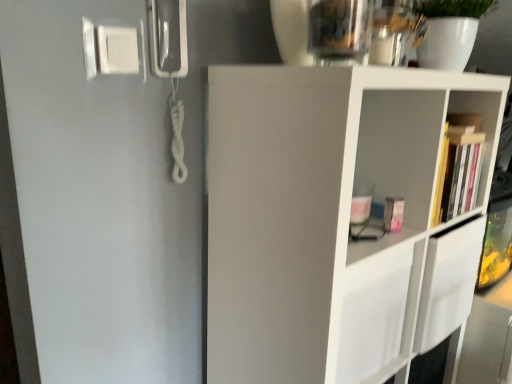
Image resolution: width=512 pixels, height=384 pixels. What do you see at coordinates (459, 174) in the screenshot?
I see `hardcover book at right` at bounding box center [459, 174].

You are a GUI agent. You are given a task and a screenshot of the screen. Output one action in this format:
    pyautogui.click(x=<x>, y=<y>)
    Task: Click on the white matte shelf at center
    This screenshot has width=512, height=384.
    Given the screenshot: What is the action you would take?
    pyautogui.click(x=335, y=220)

The width and height of the screenshot is (512, 384). I want to click on hardcover book at right, so click(x=459, y=174).

Can you confirm if hardcover book at right is thinner than white matte shelf at center?

Correct, the width of hardcover book at right is less than that of white matte shelf at center.

Relative to white matte shelf at center, is hardcover book at right in front or behind?

hardcover book at right is positioned farther from the viewer than white matte shelf at center.

Where is `book behind the white matte shelf at center`? This screenshot has width=512, height=384. book behind the white matte shelf at center is located at coordinates tap(459, 174).

The width and height of the screenshot is (512, 384). What are the coordinates of `shelf that is under the transparent glass vase at upper center (from a real-world perspective)` in the screenshot? It's located at (335, 220).

Which is more to the right, transparent glass vase at upper center or white matte shelf at center?

From the viewer's perspective, white matte shelf at center appears more on the right side.

From a real-world perspective, which is physically below, transparent glass vase at upper center or white matte shelf at center?

white matte shelf at center, from a real-world perspective.

Is transparent glass vase at upper center turned away from white matte shelf at center?

No, transparent glass vase at upper center is not facing the opposite direction of white matte shelf at center.

Can you tell me how much white matte shelf at center and transparent glass vase at upper center differ in facing direction?

The angle between the facing direction of white matte shelf at center and the facing direction of transparent glass vase at upper center is 0.794 degrees.

Looking at this image, how distant is white matte shelf at center from transparent glass vase at upper center?

They are 16.18 inches apart.

Looking at their sizes, would you say white matte shelf at center is wider or thinner than transparent glass vase at upper center?

white matte shelf at center is wider than transparent glass vase at upper center.

In terms of height, does white matte shelf at center look taller or shorter compared to transparent glass vase at upper center?

white matte shelf at center is taller than transparent glass vase at upper center.

Is hardcover book at right taller or shorter than transparent glass vase at upper center?

In the image, hardcover book at right appears to be taller than transparent glass vase at upper center.

Can you confirm if hardcover book at right is positioned to the left of transparent glass vase at upper center?

In fact, hardcover book at right is to the right of transparent glass vase at upper center.

Considering the relative positions of hardcover book at right and transparent glass vase at upper center in the image provided, is hardcover book at right behind transparent glass vase at upper center?

Yes, hardcover book at right is further from the camera.

Based on their sizes in the image, would you say hardcover book at right is bigger or smaller than transparent glass vase at upper center?

In the image, hardcover book at right appears to be larger than transparent glass vase at upper center.

Where is `glass vase above the hardcover book at right (from a real-world perspective)`? glass vase above the hardcover book at right (from a real-world perspective) is located at coordinates point(339,30).

Is transparent glass vase at upper center in front of or behind hardcover book at right in the image?

In the image, transparent glass vase at upper center appears in front of hardcover book at right.

Would you say transparent glass vase at upper center is outside hardcover book at right?

Yes, transparent glass vase at upper center is located beyond the bounds of hardcover book at right.

Are transparent glass vase at upper center and hardcover book at right located far from each other?

transparent glass vase at upper center is actually quite close to hardcover book at right.

From a real-world perspective, is white matte shelf at center located beneath hardcover book at right?

Indeed, from a real-world perspective, white matte shelf at center is positioned beneath hardcover book at right.

Considering the positions of objects white matte shelf at center and hardcover book at right in the image provided, who is more to the left, white matte shelf at center or hardcover book at right?

From the viewer's perspective, white matte shelf at center appears more on the left side.

Is point (244, 92) positioned in front of point (479, 166)?

Yes, point (244, 92) is closer to viewer.

Does white matte shelf at center turn towards hardcover book at right?

Yes, white matte shelf at center faces towards hardcover book at right.

Where is `book on the right of white matte shelf at center`? book on the right of white matte shelf at center is located at coordinates (459, 174).

In order to click on shelf in front of the transparent glass vase at upper center in this screenshot , I will do `click(335, 220)`.

From the image, which object appears to be farther from hardcover book at right, white matte shelf at center or transparent glass vase at upper center?

transparent glass vase at upper center is positioned further to the anchor hardcover book at right.

Considering their positions, is hardcover book at right positioned closer to transparent glass vase at upper center than white matte shelf at center?

white matte shelf at center is positioned closer to the anchor transparent glass vase at upper center.

From the image, which object appears to be nearer to transparent glass vase at upper center, white matte shelf at center or hardcover book at right?

white matte shelf at center.

When comparing their distances from white matte shelf at center, does hardcover book at right or transparent glass vase at upper center seem closer?

hardcover book at right lies closer to white matte shelf at center than the other object.

Looking at the image, which one is located further to hardcover book at right, transparent glass vase at upper center or white matte shelf at center?

transparent glass vase at upper center is positioned further to the anchor hardcover book at right.

Which object lies further to the anchor point white matte shelf at center, transparent glass vase at upper center or hardcover book at right?

The object further to white matte shelf at center is transparent glass vase at upper center.

This screenshot has width=512, height=384. In order to click on book that lies between transparent glass vase at upper center and white matte shelf at center from top to bottom in this screenshot , I will do `click(459, 174)`.